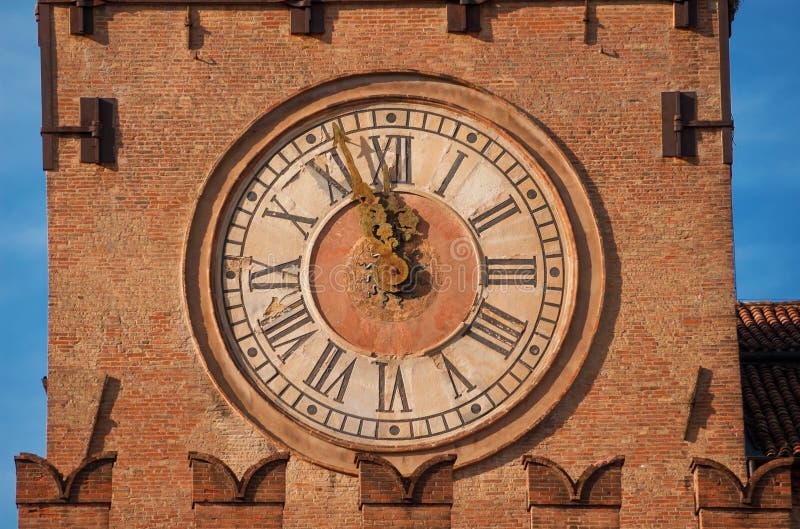
This screenshot has height=529, width=800. I want to click on steel hinge, so click(93, 130).